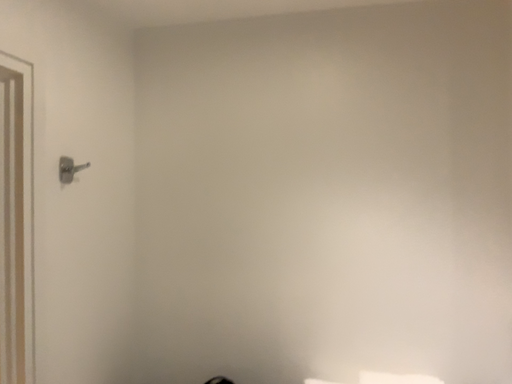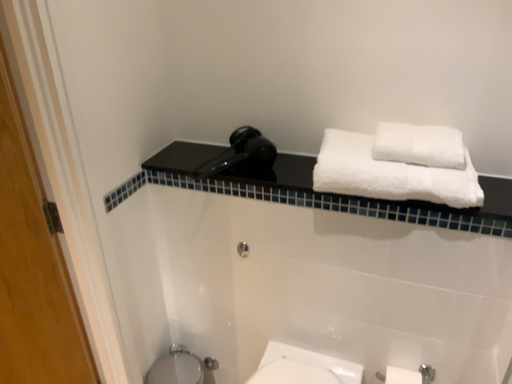
Question: How did the camera likely rotate when shooting the video?

Choices:
 (A) rotated left
 (B) rotated right

Answer: (A)